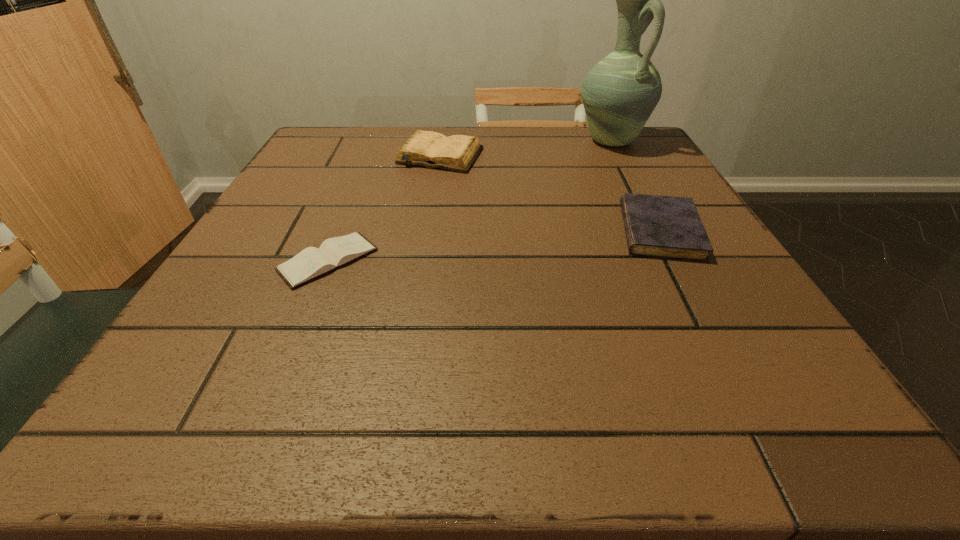
Where is `pitcher`? This screenshot has width=960, height=540. pitcher is located at coordinates (619, 93).

This screenshot has width=960, height=540. Identify the location of the third shortest object. (458, 153).

Locate an element on the screen. Image resolution: width=960 pixels, height=540 pixels. the farthest diary is located at coordinates (458, 153).

In order to click on the rightmost diary in this screenshot , I will do point(667,227).

Locate an element on the screen. The image size is (960, 540). the second shortest diary is located at coordinates (667, 227).

Find the location of a particular element. This screenshot has height=540, width=960. the shortest object is located at coordinates (310, 263).

This screenshot has height=540, width=960. I want to click on vacant space situated 0.370m on the handle side of the tallest object, so click(x=670, y=253).

The width and height of the screenshot is (960, 540). I want to click on free space located on the front of the farthest diary, so click(430, 228).

Image resolution: width=960 pixels, height=540 pixels. Find the location of `free point located 0.060m on the back of the second tallest diary`. free point located 0.060m on the back of the second tallest diary is located at coordinates (637, 189).

Where is `vacant space located on the right of the shortest diary`? The width and height of the screenshot is (960, 540). vacant space located on the right of the shortest diary is located at coordinates coord(428,260).